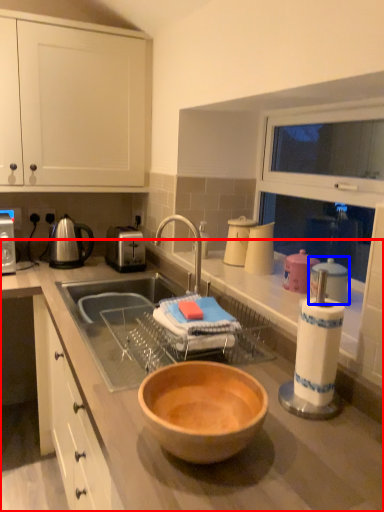
Question: Which point is further to the camera, countertop (highlighted by a red box) or appliance (highlighted by a blue box)?

Choices:
 (A) countertop
 (B) appliance

Answer: (B)